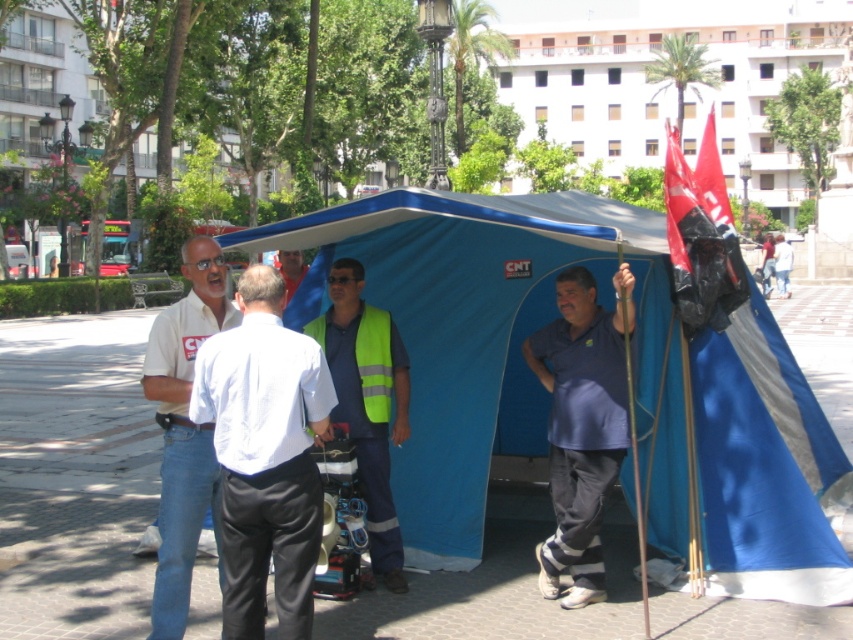
Question: Observing the image, what is the correct spatial positioning of blue fabric tent at right in reference to white cotton shirt at left?

Choices:
 (A) below
 (B) above

Answer: (A)

Question: Can you confirm if blue fabric tent at center is positioned below reflective yellow vest at center?

Choices:
 (A) no
 (B) yes

Answer: (A)

Question: Which point appears farthest from the camera in this image?

Choices:
 (A) (804, 387)
 (B) (364, 378)
 (C) (372, 419)

Answer: (A)

Question: Which point is closer to the camera?

Choices:
 (A) (184, 624)
 (B) (778, 243)

Answer: (A)

Question: Observing the image, what is the correct spatial positioning of reflective yellow vest at center in reference to yellow reflective safety vest at center?

Choices:
 (A) below
 (B) above

Answer: (A)

Question: Which object appears closest to the camera in this image?

Choices:
 (A) white cotton shirt at left
 (B) white smooth shirt at left
 (C) reflective yellow vest at center
 (D) blue fabric tent at right

Answer: (B)